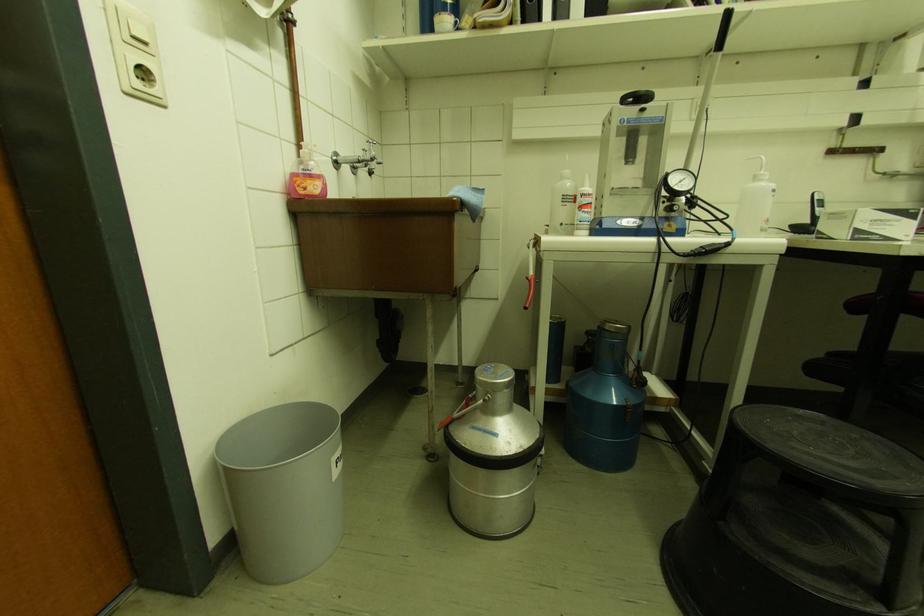
The width and height of the screenshot is (924, 616). In order to click on white bottle pump in this screenshot , I will do `click(566, 164)`.